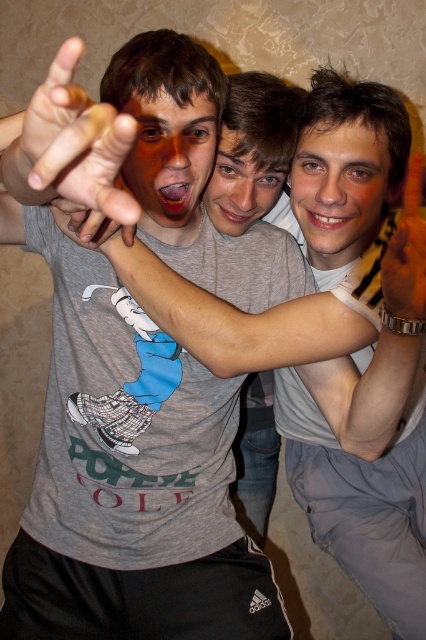
Is gray matte t-shirt at center shorter than brown leather hand at upper left?

No, gray matte t-shirt at center is not shorter than brown leather hand at upper left.

Does gray matte t-shirt at center have a smaller size compared to brown leather hand at upper left?

Actually, gray matte t-shirt at center might be larger than brown leather hand at upper left.

This screenshot has height=640, width=426. In order to click on gray matte t-shirt at center in this screenshot , I will do [x=253, y=150].

Identify the location of brown leather hand at upper left. (72, 148).

Is brown leather hand at upper left positioned before brown leather watch at upper right?

Yes, brown leather hand at upper left is closer to the viewer.

At what (x,y) coordinates should I click in order to perform the action: click on brown leather hand at upper left. Please return your answer as a coordinate pair (x, y). Looking at the image, I should click on (72, 148).

Where is `gray matte t-shirt at center`? The image size is (426, 640). gray matte t-shirt at center is located at coordinates (253, 150).

Which is more to the left, gray matte t-shirt at center or brown leather watch at upper right?

gray matte t-shirt at center

The image size is (426, 640). Identify the location of gray matte t-shirt at center. (253, 150).